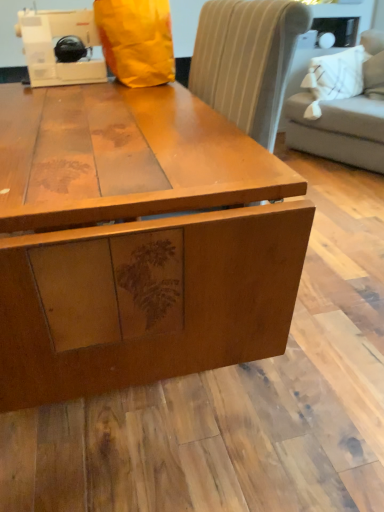
Question: In the image, is light gray fabric couch at upper right on the left side or the right side of matte wood table at center?

Choices:
 (A) right
 (B) left

Answer: (A)

Question: From the image's perspective, is light gray fabric couch at upper right located above or below matte wood table at center?

Choices:
 (A) above
 (B) below

Answer: (A)

Question: Considering the real-world distances, which object is farthest from the white plastic sewing machine at upper left?

Choices:
 (A) matte wood table at center
 (B) light gray fabric couch at upper right

Answer: (B)

Question: Considering the real-world distances, which object is closest to the white plastic sewing machine at upper left?

Choices:
 (A) light gray fabric couch at upper right
 (B) matte wood table at center

Answer: (B)